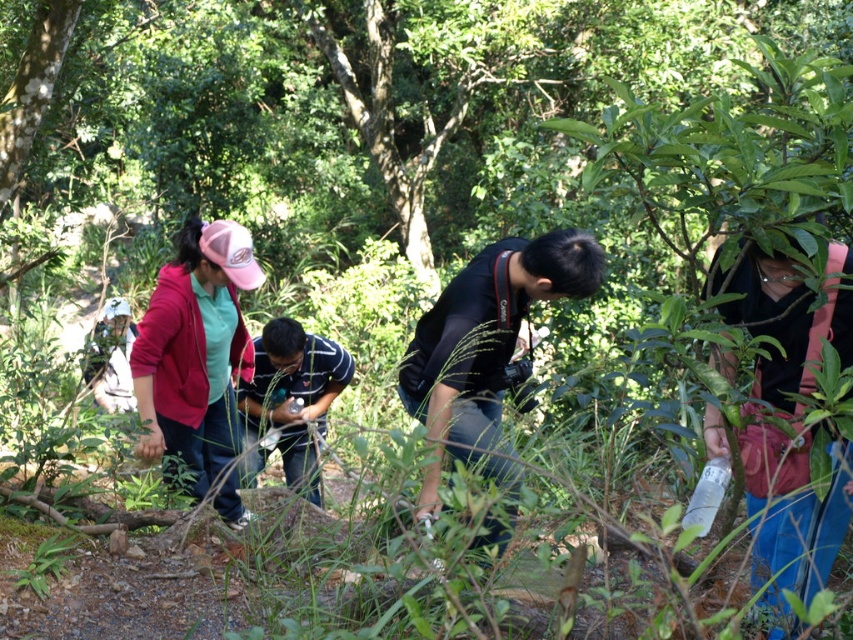
Question: Which is nearer to the striped cotton shirt at center?

Choices:
 (A) green leafy tree at center
 (B) pink fabric cap at center

Answer: (B)

Question: Which point is farther from the camera taking this photo?

Choices:
 (A) (442, 90)
 (B) (199, 291)
 (C) (279, 348)

Answer: (A)

Question: Which point is farther from the camera taking this photo?

Choices:
 (A) pyautogui.click(x=223, y=493)
 (B) pyautogui.click(x=422, y=163)

Answer: (B)

Question: Can you confirm if black matte camera at center is wider than pink fabric cap at center?

Choices:
 (A) no
 (B) yes

Answer: (B)

Question: Does green leafy tree at center appear over pink fabric cap at center?

Choices:
 (A) yes
 (B) no

Answer: (A)

Question: Is pink fabric cap at center smaller than striped cotton shirt at center?

Choices:
 (A) yes
 (B) no

Answer: (B)